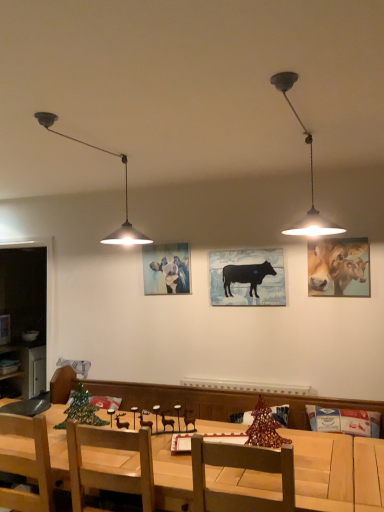
Question: Does golden glossy cattle at upper right, the first cattle in the right-to-left sequence, appear on the right side of pastel blue painting of cattle at center, which is the 2th cattle from right to left?

Choices:
 (A) yes
 (B) no

Answer: (A)

Question: Is golden glossy cattle at upper right, the first cattle in the right-to-left sequence, not within pastel blue painting of cattle at center, which is the 2th cattle from right to left?

Choices:
 (A) yes
 (B) no

Answer: (A)

Question: Is pastel blue painting of cattle at center, which is the 2th cattle from right to left, located within golden glossy cattle at upper right, marked as the 2th cattle in a left-to-right arrangement?

Choices:
 (A) yes
 (B) no

Answer: (B)

Question: Considering the relative sizes of golden glossy cattle at upper right, marked as the 2th cattle in a left-to-right arrangement, and pastel blue painting of cattle at center, arranged as the 2th cattle when viewed from the front, in the image provided, is golden glossy cattle at upper right, marked as the 2th cattle in a left-to-right arrangement, taller than pastel blue painting of cattle at center, arranged as the 2th cattle when viewed from the front,?

Choices:
 (A) no
 (B) yes

Answer: (B)

Question: Is golden glossy cattle at upper right, which is counted as the second cattle, starting from the back, wider than pastel blue painting of cattle at center, the 1th cattle from the back?

Choices:
 (A) yes
 (B) no

Answer: (B)

Question: Is golden glossy cattle at upper right, the first cattle in the right-to-left sequence, situated inside wooden chair at center or outside?

Choices:
 (A) inside
 (B) outside

Answer: (B)

Question: From their relative heights in the image, would you say golden glossy cattle at upper right, positioned as the first cattle in front-to-back order, is taller or shorter than wooden chair at center?

Choices:
 (A) short
 (B) tall

Answer: (A)

Question: From the image's perspective, is golden glossy cattle at upper right, which is counted as the second cattle, starting from the back, above or below wooden chair at center?

Choices:
 (A) above
 (B) below

Answer: (A)

Question: Relative to wooden chair at center, is golden glossy cattle at upper right, positioned as the first cattle in front-to-back order, in front or behind?

Choices:
 (A) front
 (B) behind

Answer: (B)

Question: From the image's perspective, is black wooden cow at center above or below metallic silver cabinet at left?

Choices:
 (A) above
 (B) below

Answer: (A)

Question: Considering the positions of point (221, 293) and point (21, 367), is point (221, 293) closer or farther from the camera than point (21, 367)?

Choices:
 (A) closer
 (B) farther

Answer: (A)

Question: Is black wooden cow at center situated inside metallic silver cabinet at left or outside?

Choices:
 (A) inside
 (B) outside

Answer: (B)

Question: From a real-world perspective, is black wooden cow at center physically located above or below metallic silver cabinet at left?

Choices:
 (A) above
 (B) below

Answer: (A)

Question: Is metallic pendant light at upper right, the second lamp positioned from the left, inside or outside of black wooden cow at center?

Choices:
 (A) inside
 (B) outside

Answer: (B)

Question: From a real-world perspective, is metallic pendant light at upper right, the second lamp positioned from the left, physically located above or below black wooden cow at center?

Choices:
 (A) above
 (B) below

Answer: (A)